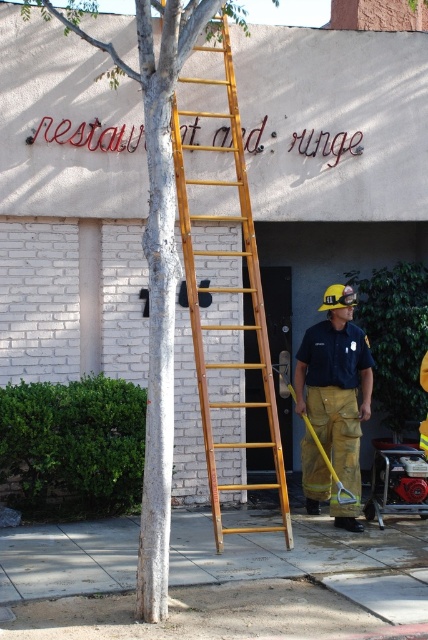
Question: Is white textured tree at center thinner than wooden ladder at center?

Choices:
 (A) no
 (B) yes

Answer: (B)

Question: Which object is farther from the camera taking this photo?

Choices:
 (A) white textured tree at center
 (B) wooden ladder at center
 (C) yellow fire-resistant pants at center

Answer: (C)

Question: Is wooden ladder at center in front of yellow fire-resistant pants at center?

Choices:
 (A) yes
 (B) no

Answer: (A)

Question: Considering the real-world distances, which object is farthest from the wooden ladder at center?

Choices:
 (A) white textured tree at center
 (B) yellow fire-resistant pants at center

Answer: (A)

Question: Which of these objects is positioned farthest from the wooden ladder at center?

Choices:
 (A) yellow fire-resistant pants at center
 (B) white textured tree at center

Answer: (B)

Question: Does white textured tree at center come in front of yellow fire-resistant pants at center?

Choices:
 (A) no
 (B) yes

Answer: (B)